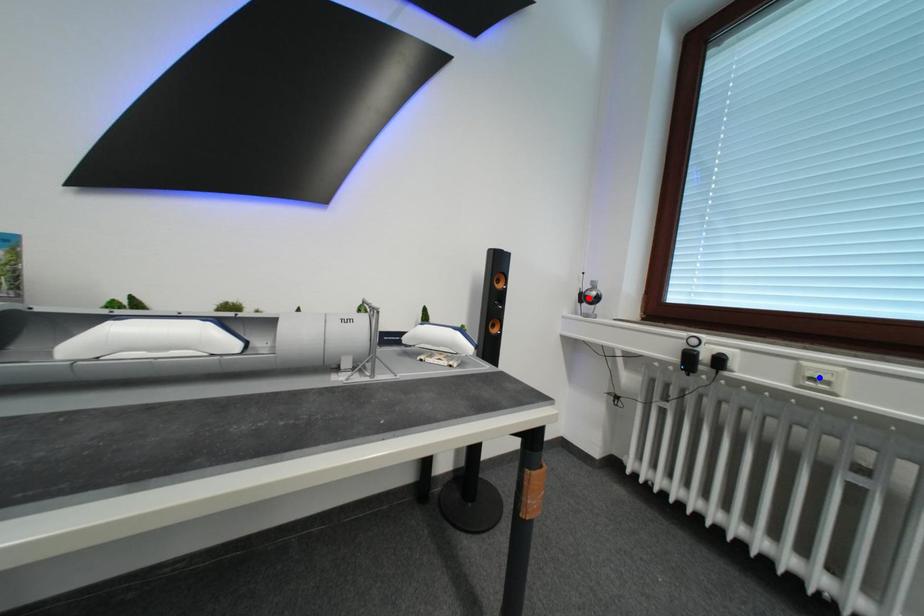
Question: Two points are marked on the image. Which point is closer to the camera?

Choices:
 (A) Blue point is closer.
 (B) Red point is closer.

Answer: (A)